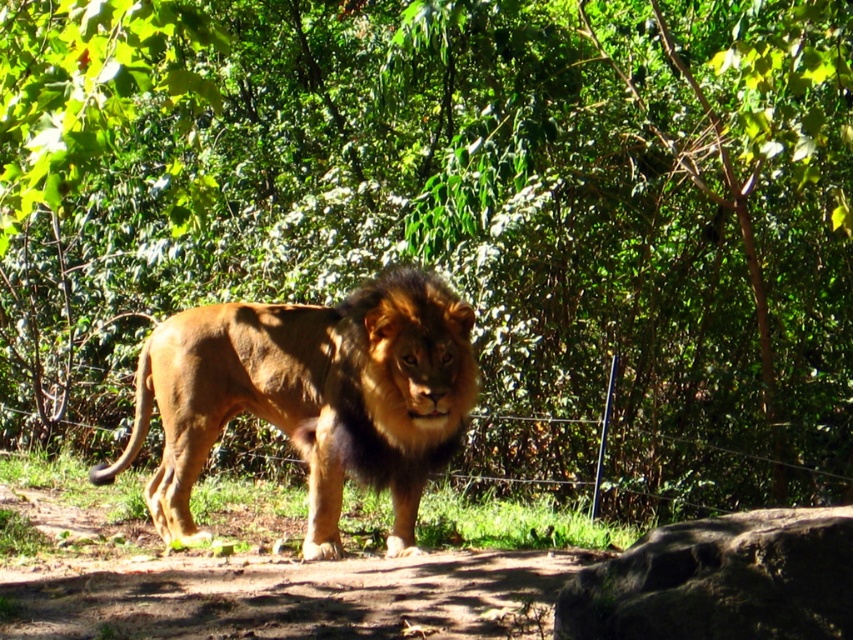
Based on the photo, does golden fur lion at center have a greater height compared to brown rough rock at lower right?

Yes.

Does golden fur lion at center have a larger size compared to brown rough rock at lower right?

Indeed, golden fur lion at center has a larger size compared to brown rough rock at lower right.

Which is behind, point (399, 547) or point (788, 604)?

Positioned behind is point (399, 547).

Where is `golden fur lion at center`? golden fur lion at center is located at coordinates (312, 396).